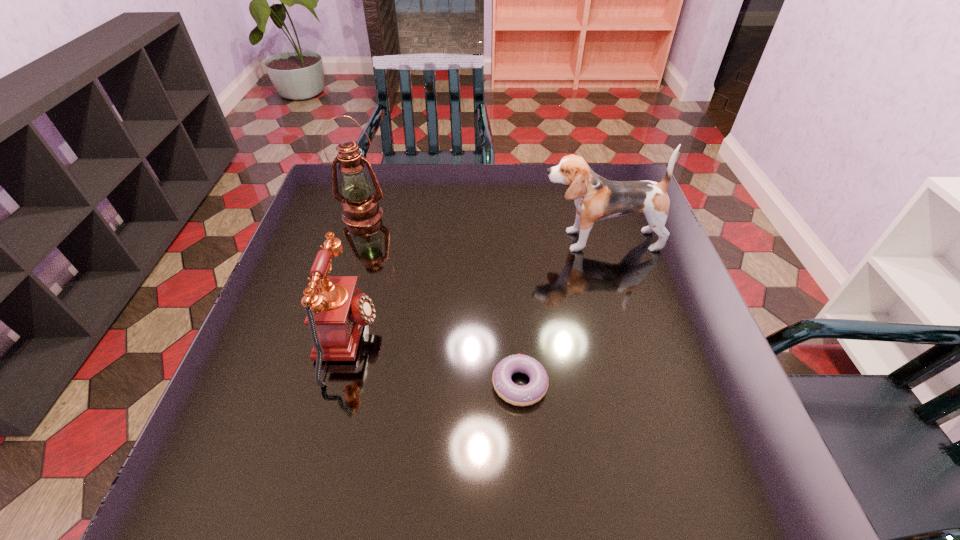
Find the location of `blank space located 0.300m on the dial of the third tallest object`. blank space located 0.300m on the dial of the third tallest object is located at coordinates (516, 340).

You are a GUI agent. You are given a task and a screenshot of the screen. Output one action in this format:
    pyautogui.click(x=<x>, y=<y>)
    Task: Click on the free space located 0.270m on the right of the doughnut
    
    Given the screenshot: What is the action you would take?
    pyautogui.click(x=684, y=384)

At what (x,y) coordinates should I click in order to perform the action: click on object present at the far edge. Please return your answer as a coordinate pair (x, y). Looking at the image, I should click on (360, 207).

At what (x,y) coordinates should I click in order to perform the action: click on oil lamp located in the left edge section of the desktop. Please return your answer as a coordinate pair (x, y). Looking at the image, I should click on (360, 207).

This screenshot has width=960, height=540. I want to click on telephone located in the left edge section of the desktop, so click(x=336, y=312).

You are a GUI agent. You are given a task and a screenshot of the screen. Output one action in this format:
    pyautogui.click(x=<x>, y=<y>)
    Task: Click on the object that is at the right edge
    
    Given the screenshot: What is the action you would take?
    [x=596, y=198]

Locate an element on the screen. object situated at the far left corner is located at coordinates (360, 207).

Image resolution: width=960 pixels, height=540 pixels. In the image, there is a desktop. Identify the location of vacant area at the far edge. (449, 202).

Where is `vacant region at the near edge of the desktop`? This screenshot has width=960, height=540. vacant region at the near edge of the desktop is located at coordinates pyautogui.click(x=431, y=494).

The width and height of the screenshot is (960, 540). In the image, there is a desktop. Find the location of `vacant space at the left edge`. vacant space at the left edge is located at coordinates (291, 255).